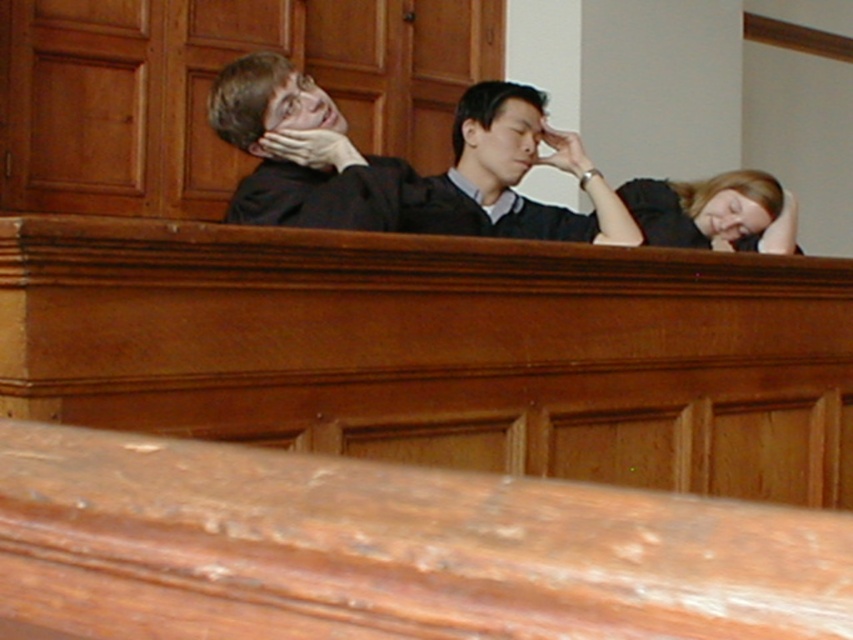
Looking at this image, you are an observer in the courtroom scene. You notice two people with distinct hair colors. Which person with blonde hair at upper right is positioned more to the right compared to the matte black hair at center?

The blonde hair at upper right is positioned to the right of the matte black hair at center.

In the courtroom scene, you notice two objects labeled as the matte black suit at upper left and the matte black hair at center. Which one appears taller in the image?

The matte black suit at upper left is much taller than the matte black hair at center.